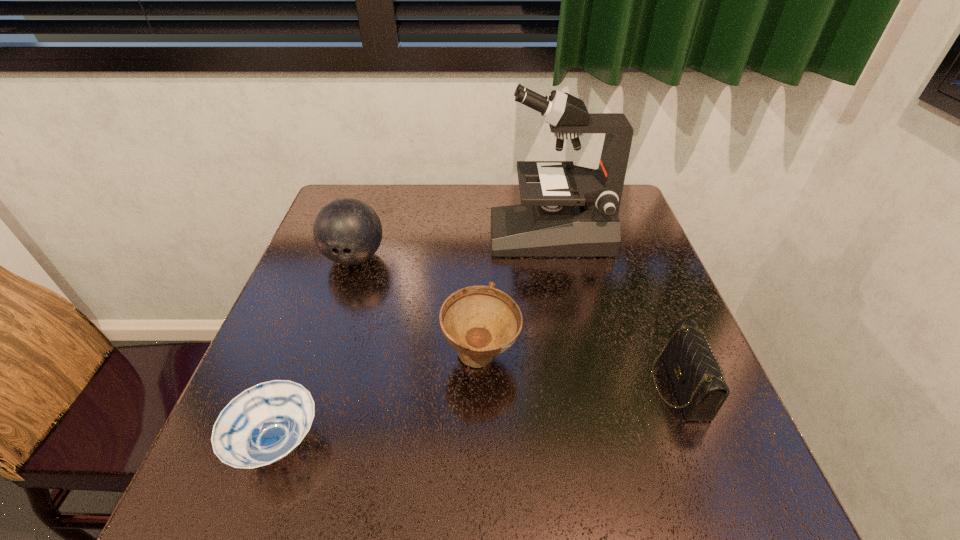
Identify the location of the closest object to the fourth tallest object. (480, 322).

Where is `vacant position in the image that satisfies the following two spatial constraints: 1. on the grip area of the bowling ball; 2. on the right side of the farther soup bowl`? The image size is (960, 540). vacant position in the image that satisfies the following two spatial constraints: 1. on the grip area of the bowling ball; 2. on the right side of the farther soup bowl is located at coordinates click(322, 356).

Where is `free space that satisfies the following two spatial constraints: 1. through the eyepieces of the tallest object; 2. on the front side of the nearer soup bowl`? free space that satisfies the following two spatial constraints: 1. through the eyepieces of the tallest object; 2. on the front side of the nearer soup bowl is located at coordinates (590, 443).

The height and width of the screenshot is (540, 960). In order to click on free space that satisfies the following two spatial constraints: 1. on the grip area of the third shortest object; 2. on the right side of the second tallest object in this screenshot , I will do `click(322, 356)`.

Where is `vacant point that satisfies the following two spatial constraints: 1. on the grip area of the taller soup bowl; 2. on the left side of the bowling ball`? vacant point that satisfies the following two spatial constraints: 1. on the grip area of the taller soup bowl; 2. on the left side of the bowling ball is located at coordinates (x=322, y=356).